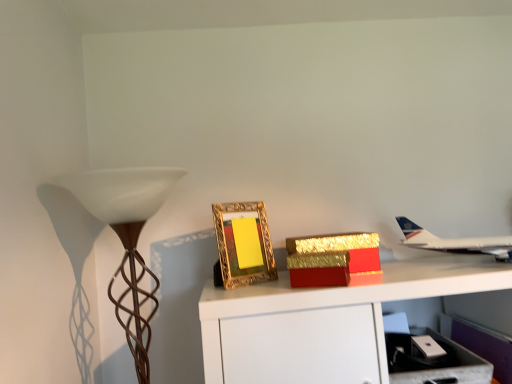
Locate an element on the screen. gold cardboard box at center is located at coordinates (319, 269).

Measure the distance between point [293,287] and camera.

The depth of point [293,287] is 37.80 inches.

The width and height of the screenshot is (512, 384). Describe the element at coordinates (127, 237) in the screenshot. I see `brown textured lamp at left` at that location.

Locate an element on the screen. gold glittery box at center is located at coordinates (331, 258).

Where is `gold cardboard box at center`? gold cardboard box at center is located at coordinates (319, 269).

From the picture: Is white metallic airplane at upper right at the right side of gold ornate frame at center?

Indeed, white metallic airplane at upper right is positioned on the right side of gold ornate frame at center.

Is white metallic airplane at upper right further to camera compared to gold ornate frame at center?

No, it is not.

From the image's perspective, which is above, white metallic airplane at upper right or gold ornate frame at center?

From the image's view, gold ornate frame at center is above.

What's the angular difference between white metallic airplane at upper right and gold ornate frame at center's facing directions?

white metallic airplane at upper right and gold ornate frame at center are facing 37.3 degrees away from each other.

Is white metallic airplane at upper right facing towards metallic silver drawer at lower right?

No, white metallic airplane at upper right does not turn towards metallic silver drawer at lower right.

Can metallic silver drawer at lower right be found inside white metallic airplane at upper right?

No, metallic silver drawer at lower right is not inside white metallic airplane at upper right.

Considering the positions of points (426, 243) and (407, 350), is point (426, 243) closer to camera compared to point (407, 350)?

That is False.

Does white metallic airplane at upper right have a larger size compared to metallic silver drawer at lower right?

Correct, white metallic airplane at upper right is larger in size than metallic silver drawer at lower right.

Based on the photo, from the image's perspective, is gold cardboard box at center below gold ornate frame at center?

Correct, gold cardboard box at center appears lower than gold ornate frame at center in the image.

Which is behind, point (337, 266) or point (226, 277)?

The point (226, 277) is more distant.

From a real-world perspective, is gold cardboard box at center positioned under gold ornate frame at center based on gravity?

Yes, from a real-world perspective, gold cardboard box at center is under gold ornate frame at center.

Can gold ornate frame at center be found inside gold cardboard box at center?

Actually, gold ornate frame at center is outside gold cardboard box at center.

Is point (142, 323) farther from camera compared to point (251, 236)?

That is False.

Which is more to the left, brown textured lamp at left or gold ornate frame at center?

brown textured lamp at left is more to the left.

From the image's perspective, which is above, brown textured lamp at left or gold ornate frame at center?

gold ornate frame at center.

The width and height of the screenshot is (512, 384). I want to click on lamp that appears below the gold ornate frame at center (from a real-world perspective), so click(x=127, y=237).

Image resolution: width=512 pixels, height=384 pixels. In order to click on box on the right of the gold ornate frame at center in this screenshot , I will do `click(331, 258)`.

How distant is gold ornate frame at center from gold glittery box at center?

gold ornate frame at center and gold glittery box at center are 16.14 centimeters apart from each other.

In terms of height, does gold ornate frame at center look taller or shorter compared to gold glittery box at center?

Considering their sizes, gold ornate frame at center has more height than gold glittery box at center.

Is gold glittery box at center surrounded by gold ornate frame at center?

No, gold glittery box at center is not surrounded by gold ornate frame at center.

Does gold ornate frame at center come in front of metallic silver drawer at lower right?

No, it is behind metallic silver drawer at lower right.

Is point (241, 209) positioned before point (476, 358)?

No, (241, 209) is further to viewer.

Considering the relative sizes of gold ornate frame at center and metallic silver drawer at lower right in the image provided, is gold ornate frame at center smaller than metallic silver drawer at lower right?

Yes.

Which is more to the left, gold ornate frame at center or metallic silver drawer at lower right?

gold ornate frame at center is more to the left.

From a real-world perspective, is gold ornate frame at center physically located above or below white metallic airplane at upper right?

gold ornate frame at center is situated higher than white metallic airplane at upper right in the real world.

Is gold ornate frame at center positioned with its back to white metallic airplane at upper right?

No, gold ornate frame at center is not facing the opposite direction of white metallic airplane at upper right.

Looking at this image, considering the sizes of objects gold ornate frame at center and white metallic airplane at upper right in the image provided, who is taller, gold ornate frame at center or white metallic airplane at upper right?

Standing taller between the two is gold ornate frame at center.

Identify the location of airplane on the right of gold ornate frame at center. This screenshot has height=384, width=512. (455, 242).

In order to click on drawer in front of the white metallic airplane at upper right in this screenshot , I will do `click(436, 364)`.

Based on their spatial positions, is gold ornate frame at center or gold cardboard box at center closer to brown textured lamp at left?

gold ornate frame at center lies closer to brown textured lamp at left than the other object.

Based on their spatial positions, is gold cardboard box at center or metallic silver drawer at lower right closer to brown textured lamp at left?

gold cardboard box at center is closer to brown textured lamp at left.

From the image, which object appears to be farther from gold glittery box at center, gold ornate frame at center or gold cardboard box at center?

gold ornate frame at center.

Looking at the image, which one is located closer to white metallic airplane at upper right, gold ornate frame at center or gold cardboard box at center?

gold cardboard box at center is positioned closer to the anchor white metallic airplane at upper right.

Looking at the image, which one is located closer to brown textured lamp at left, gold glittery box at center or gold ornate frame at center?

Among the two, gold ornate frame at center is located nearer to brown textured lamp at left.

Which object lies nearer to the anchor point white metallic airplane at upper right, gold cardboard box at center or gold glittery box at center?

Based on the image, gold glittery box at center appears to be nearer to white metallic airplane at upper right.

Which object lies nearer to the anchor point gold cardboard box at center, gold glittery box at center or brown textured lamp at left?

The object closer to gold cardboard box at center is gold glittery box at center.

When comparing their distances from metallic silver drawer at lower right, does gold cardboard box at center or gold glittery box at center seem closer?

The object closer to metallic silver drawer at lower right is gold glittery box at center.

This screenshot has width=512, height=384. What are the coordinates of `drawer situated between gold ornate frame at center and white metallic airplane at upper right from left to right` in the screenshot? It's located at (436, 364).

This screenshot has width=512, height=384. I want to click on cardboard box between brown textured lamp at left and gold glittery box at center in the horizontal direction, so click(319, 269).

Identify the location of cardboard box between brown textured lamp at left and metallic silver drawer at lower right in the horizontal direction. Image resolution: width=512 pixels, height=384 pixels. (319, 269).

Find the location of a particular element. The image size is (512, 384). picture frame between brown textured lamp at left and metallic silver drawer at lower right is located at coordinates (244, 243).